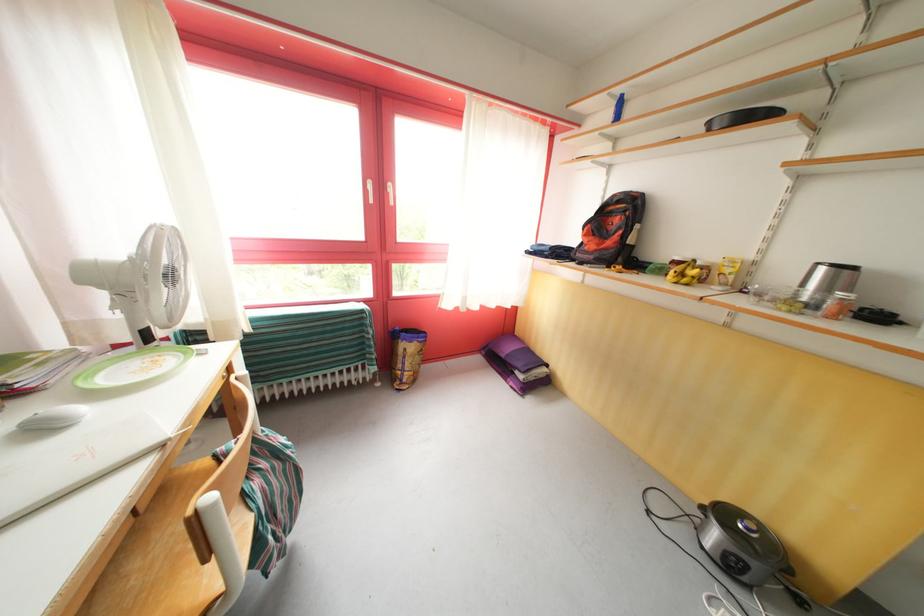
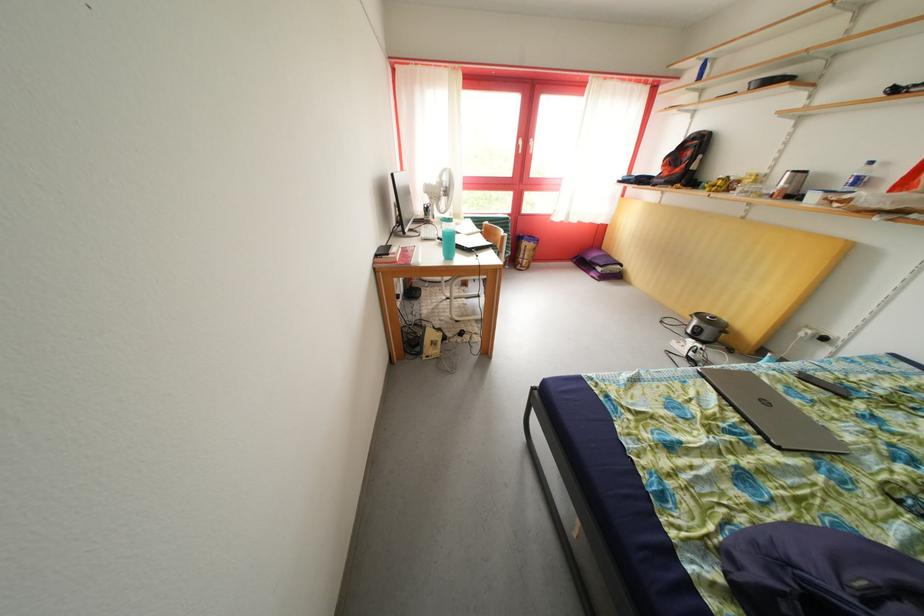
Locate, in the second image, the point that corresponds to (x=738, y=575) in the first image.

(702, 342)